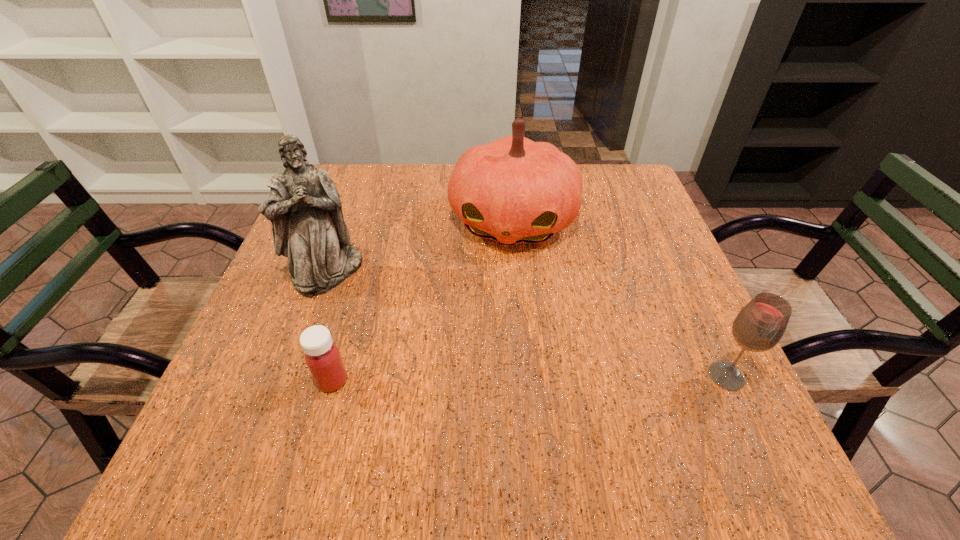
I want to click on free space located 0.270m on the front-facing side of the second tallest object, so click(484, 356).

You are a GUI agent. You are given a task and a screenshot of the screen. Output one action in this format:
    pyautogui.click(x=<x>, y=<y>)
    Task: Click on the blank space located 0.400m on the front-facing side of the figurine
    This screenshot has height=540, width=960.
    Given the screenshot: What is the action you would take?
    (491, 398)

In order to click on vacant region located on the front-facing side of the figurine in this screenshot , I will do `click(453, 369)`.

Identify the location of free space located on the front-facing side of the figurine. (415, 340).

Locate an element on the screen. Image resolution: width=960 pixels, height=540 pixels. object located in the far edge section of the desktop is located at coordinates (513, 190).

The height and width of the screenshot is (540, 960). Find the location of `medicine located in the near edge section of the desktop`. medicine located in the near edge section of the desktop is located at coordinates (322, 356).

Where is `glass drink container located at the near edge`? glass drink container located at the near edge is located at coordinates (759, 326).

The width and height of the screenshot is (960, 540). Identify the location of medicine positioned at the left edge. pyautogui.click(x=322, y=356).

I want to click on figurine that is positioned at the left edge, so click(x=304, y=206).

Locate an element on the screen. object situated at the right edge is located at coordinates (759, 326).